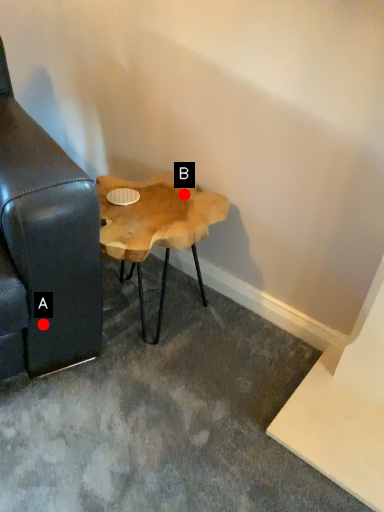
Question: Two points are circled on the image, labeled by A and B beside each circle. Which point appears farthest from the camera in this image?

Choices:
 (A) A is further
 (B) B is further

Answer: (B)